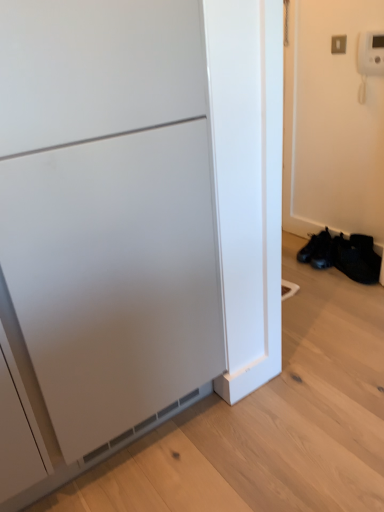
Question: Is matte white cabinet at left at the right side of black mesh shoe at lower right?

Choices:
 (A) yes
 (B) no

Answer: (B)

Question: Considering the relative sizes of matte white cabinet at left and black mesh shoe at lower right in the image provided, is matte white cabinet at left shorter than black mesh shoe at lower right?

Choices:
 (A) no
 (B) yes

Answer: (A)

Question: From a real-world perspective, is matte white cabinet at left on black mesh shoe at lower right?

Choices:
 (A) yes
 (B) no

Answer: (A)

Question: Does matte white cabinet at left have a greater width compared to black mesh shoe at lower right?

Choices:
 (A) yes
 (B) no

Answer: (A)

Question: Is matte white cabinet at left with black mesh shoe at lower right?

Choices:
 (A) no
 (B) yes

Answer: (A)

Question: Looking at their shapes, would you say black mesh shoe at lower right is wider or thinner than matte white cabinet at left?

Choices:
 (A) wide
 (B) thin

Answer: (B)

Question: From a real-world perspective, is black mesh shoe at lower right positioned above or below matte white cabinet at left?

Choices:
 (A) below
 (B) above

Answer: (A)

Question: In the image, is black mesh shoe at lower right positioned in front of or behind matte white cabinet at left?

Choices:
 (A) front
 (B) behind

Answer: (B)

Question: From the image's perspective, relative to matte white cabinet at left, is black mesh shoe at lower right above or below?

Choices:
 (A) above
 (B) below

Answer: (B)

Question: Looking at their shapes, would you say matte white cabinet at left is wider or thinner than black leather shoes at lower right?

Choices:
 (A) wide
 (B) thin

Answer: (A)

Question: Is matte white cabinet at left to the left or to the right of black leather shoes at lower right in the image?

Choices:
 (A) left
 (B) right

Answer: (A)

Question: Based on their sizes in the image, would you say matte white cabinet at left is bigger or smaller than black leather shoes at lower right?

Choices:
 (A) big
 (B) small

Answer: (A)

Question: Which is correct: matte white cabinet at left is inside black leather shoes at lower right, or outside of it?

Choices:
 (A) inside
 (B) outside

Answer: (B)

Question: In the image, is matte white cabinet at left on the left side or the right side of black mesh shoe at lower right?

Choices:
 (A) left
 (B) right

Answer: (A)

Question: From a real-world perspective, is matte white cabinet at left physically located above or below black mesh shoe at lower right?

Choices:
 (A) below
 (B) above

Answer: (B)